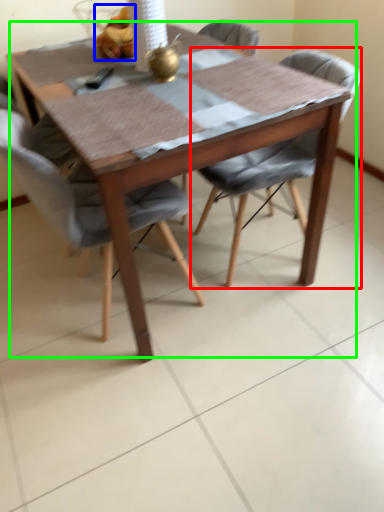
Question: Estimate the real-world distances between objects in this image. Which object is closer to chair (highlighted by a red box), food (highlighted by a blue box) or kitchen & dining room table (highlighted by a green box)?

Choices:
 (A) food
 (B) kitchen & dining room table

Answer: (B)